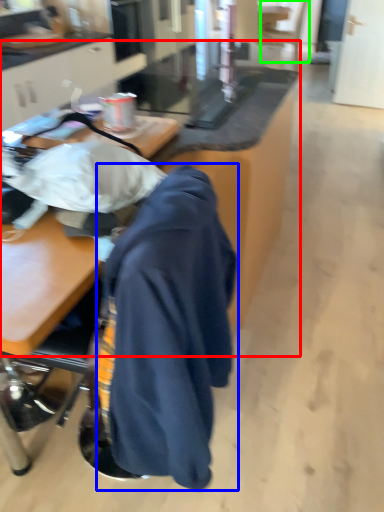
Question: Estimate the real-world distances between objects in this image. Which object is farther from table (highlighted by a red box), cloak (highlighted by a blue box) or swivel chair (highlighted by a green box)?

Choices:
 (A) cloak
 (B) swivel chair

Answer: (B)